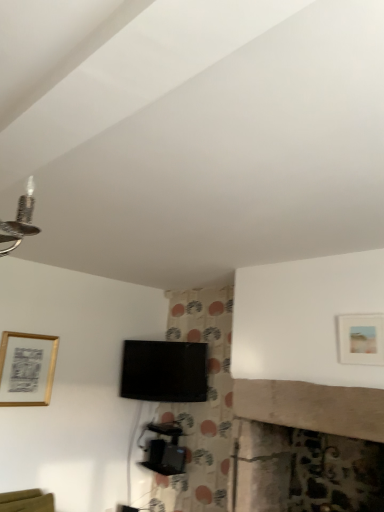
Question: Is gold metallic picture frame at upper left, marked as the 1th picture frame in a left-to-right arrangement, oriented away from black glossy tv at center?

Choices:
 (A) no
 (B) yes

Answer: (A)

Question: Is gold metallic picture frame at upper left, the second picture frame in the front-to-back sequence, located outside black glossy tv at center?

Choices:
 (A) no
 (B) yes

Answer: (B)

Question: Is gold metallic picture frame at upper left, the 2th picture frame in the top-to-bottom sequence, further to camera compared to black glossy tv at center?

Choices:
 (A) yes
 (B) no

Answer: (B)

Question: Considering the relative sizes of gold metallic picture frame at upper left, which is the second picture frame in right-to-left order, and black glossy tv at center in the image provided, is gold metallic picture frame at upper left, which is the second picture frame in right-to-left order, shorter than black glossy tv at center?

Choices:
 (A) yes
 (B) no

Answer: (B)

Question: Is the depth of gold metallic picture frame at upper left, the second picture frame in the front-to-back sequence, less than that of black glossy tv at center?

Choices:
 (A) no
 (B) yes

Answer: (B)

Question: Considering the relative positions of black plastic tv stand at center and gold metallic picture frame at upper left, the 2th picture frame in the top-to-bottom sequence, in the image provided, is black plastic tv stand at center to the left or to the right of gold metallic picture frame at upper left, the 2th picture frame in the top-to-bottom sequence,?

Choices:
 (A) left
 (B) right

Answer: (B)

Question: Does point (180, 467) appear closer or farther from the camera than point (0, 388)?

Choices:
 (A) farther
 (B) closer

Answer: (A)

Question: Is black plastic tv stand at center taller or shorter than gold metallic picture frame at upper left, which is the second picture frame in right-to-left order?

Choices:
 (A) tall
 (B) short

Answer: (B)

Question: Is black plastic tv stand at center inside the boundaries of gold metallic picture frame at upper left, arranged as the first picture frame when viewed from the back, or outside?

Choices:
 (A) inside
 (B) outside

Answer: (B)

Question: In terms of width, does gold metallic picture frame at upper left, which is the second picture frame in right-to-left order, look wider or thinner when compared to black plastic tv stand at center?

Choices:
 (A) wide
 (B) thin

Answer: (B)

Question: Based on their sizes in the image, would you say gold metallic picture frame at upper left, the second picture frame in the front-to-back sequence, is bigger or smaller than black plastic tv stand at center?

Choices:
 (A) small
 (B) big

Answer: (A)

Question: From the image's perspective, is gold metallic picture frame at upper left, arranged as the first picture frame when viewed from the back, positioned above or below black plastic tv stand at center?

Choices:
 (A) below
 (B) above

Answer: (B)

Question: Is gold metallic picture frame at upper left, the 2th picture frame in the top-to-bottom sequence, inside the boundaries of black plastic tv stand at center, or outside?

Choices:
 (A) outside
 (B) inside

Answer: (A)

Question: Is gold metallic picture frame at upper left, the 2th picture frame in the top-to-bottom sequence, bigger or smaller than matte gold picture frame at upper right, acting as the 2th picture frame starting from the bottom?

Choices:
 (A) big
 (B) small

Answer: (A)

Question: Based on their positions, is gold metallic picture frame at upper left, marked as the 1th picture frame in a left-to-right arrangement, located to the left or right of matte gold picture frame at upper right, positioned as the 1th picture frame in right-to-left order?

Choices:
 (A) left
 (B) right

Answer: (A)